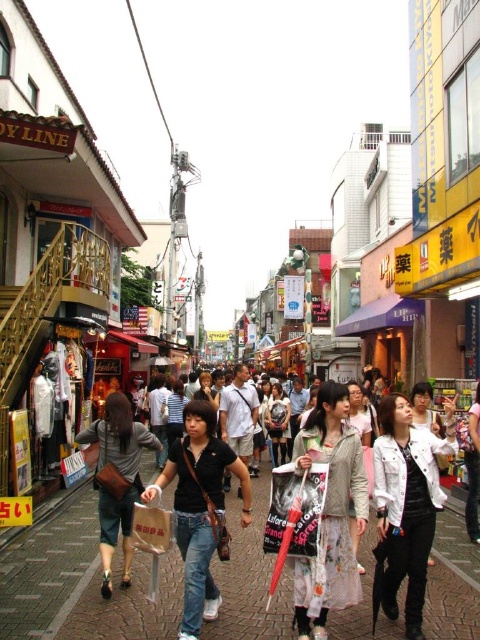
You are a photographer standing on the bustling street scene. You want to capture a photo of the white matte jacket at lower right and the black denim jeans at center. Which object should you focus on first if you want to include both in your frame without moving the camera?

The white matte jacket at lower right is taller than the black denim jeans at center, so you should focus on the white matte jacket at lower right first to ensure its full height is captured in the frame.

You are standing at a point in the street and want to know how far you are from the camera. The coordinates of your current position are point (277, 627). Can you determine the distance?

The distance between point (277, 627) and the camera is 42.73 meters.